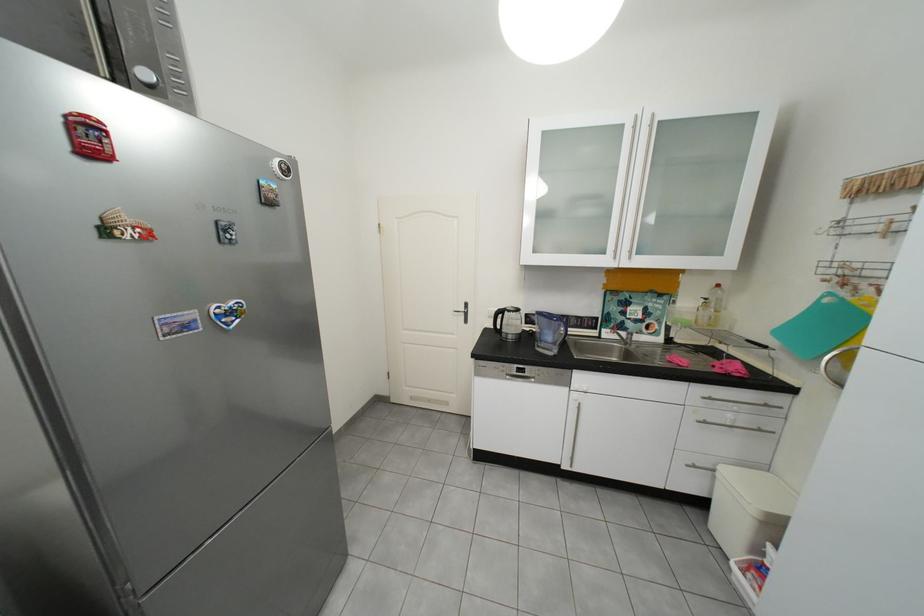
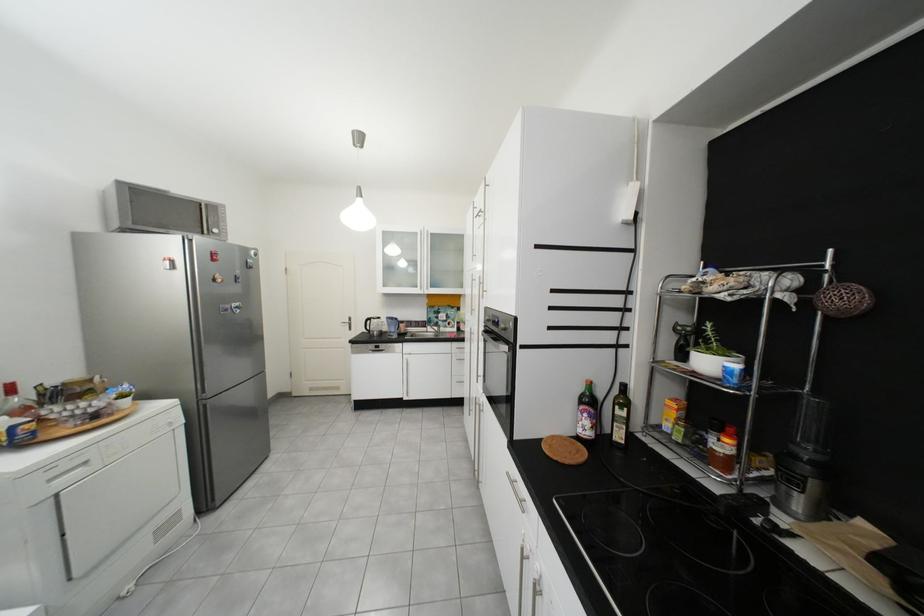
In the second image, find the point that corresponds to (198,328) in the first image.

(237, 310)